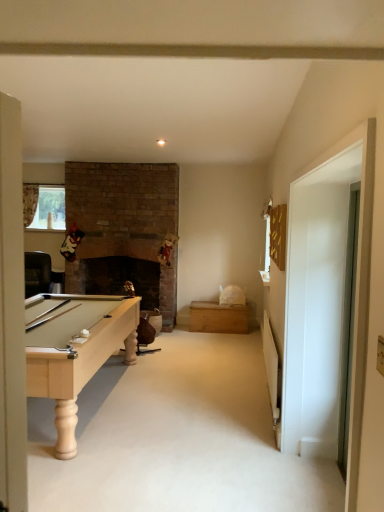
Question: Does clear glass window at upper left have a smaller size compared to transparent glass door at right, which appears as the 1th glass door when viewed from the right?

Choices:
 (A) no
 (B) yes

Answer: (B)

Question: Is clear glass window at upper left bigger than transparent glass door at right, which appears as the 1th glass door when viewed from the right?

Choices:
 (A) yes
 (B) no

Answer: (B)

Question: Does clear glass window at upper left appear on the right side of transparent glass door at right, which appears as the 1th glass door when viewed from the right?

Choices:
 (A) no
 (B) yes

Answer: (A)

Question: From the image's perspective, is clear glass window at upper left above transparent glass door at right, the 2th glass door viewed from the left?

Choices:
 (A) yes
 (B) no

Answer: (A)

Question: From a real-world perspective, is clear glass window at upper left on transparent glass door at right, which appears as the 1th glass door when viewed from the right?

Choices:
 (A) no
 (B) yes

Answer: (B)

Question: Is the position of clear glass window at upper left less distant than that of transparent glass door at right, the 2th glass door viewed from the left?

Choices:
 (A) no
 (B) yes

Answer: (A)

Question: From a real-world perspective, is transparent glass door at right, which appears as the 1th glass door when viewed from the right, over clear glass window at upper left?

Choices:
 (A) no
 (B) yes

Answer: (A)

Question: From the image's perspective, is transparent glass door at right, which appears as the 1th glass door when viewed from the right, on clear glass window at upper left?

Choices:
 (A) no
 (B) yes

Answer: (A)

Question: Is transparent glass door at right, the 2th glass door viewed from the left, far from clear glass window at upper left?

Choices:
 (A) yes
 (B) no

Answer: (A)

Question: Can you confirm if transparent glass door at right, the 2th glass door viewed from the left, is taller than clear glass window at upper left?

Choices:
 (A) no
 (B) yes

Answer: (B)

Question: Can you confirm if transparent glass door at right, which appears as the 1th glass door when viewed from the right, is shorter than clear glass window at upper left?

Choices:
 (A) yes
 (B) no

Answer: (B)

Question: From the image's perspective, is transparent glass door at right, the 2th glass door viewed from the left, below clear glass window at upper left?

Choices:
 (A) yes
 (B) no

Answer: (A)

Question: Is clear glass window at upper left at the left side of white glossy door at right, the 2th glass door positioned from the right?

Choices:
 (A) yes
 (B) no

Answer: (A)